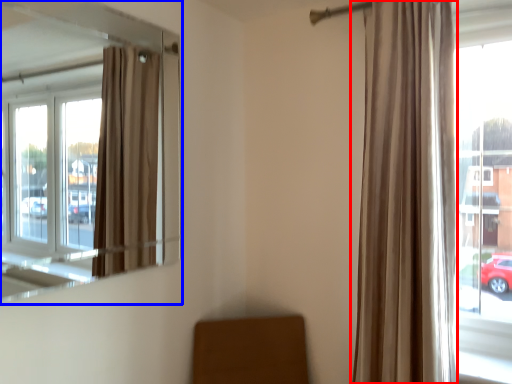
Question: Which point is closer to the camera, curtain (highlighted by a red box) or window (highlighted by a blue box)?

Choices:
 (A) curtain
 (B) window

Answer: (B)